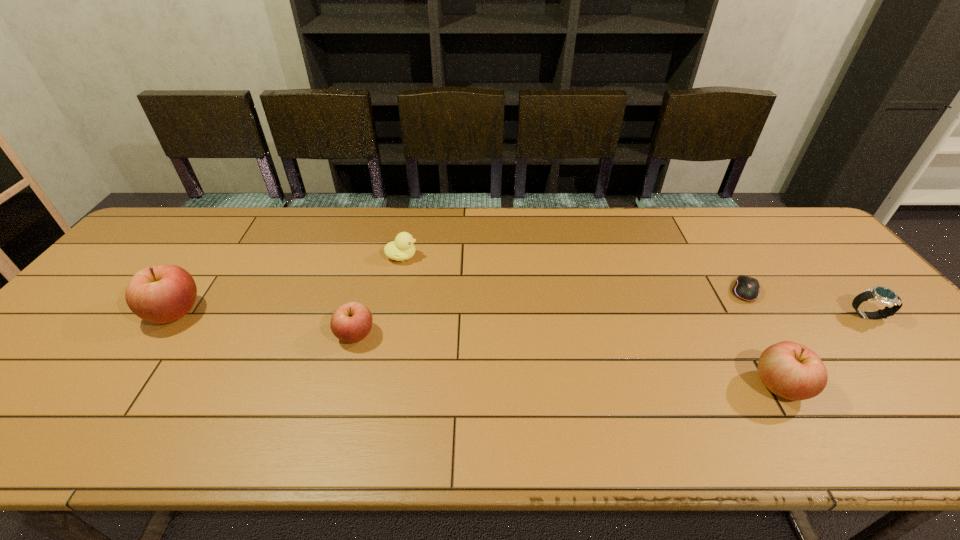
To make them evenly spaced by inserting another apple among them, please locate a vacant spot for this new apple. Please provide its 2D coordinates. Your answer should be formatted as a tuple, i.e. [(x, y)], where the tuple contains the x and y coordinates of a point satisfying the conditions above.

[(556, 359)]